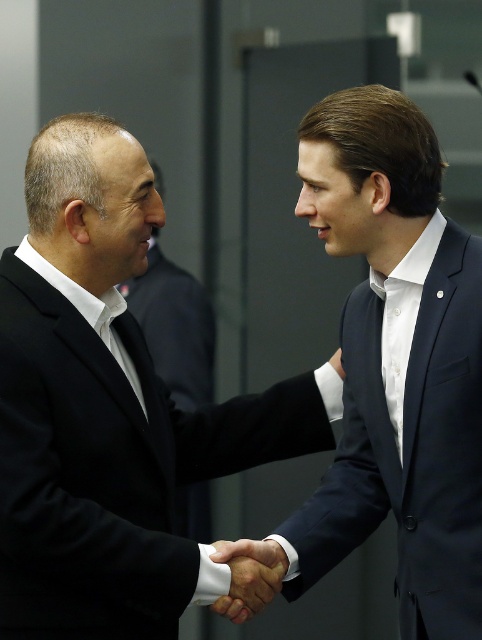
Which of these two, black matte suit at left or matte black suit at left, stands taller?

black matte suit at left

The width and height of the screenshot is (482, 640). What do you see at coordinates (109, 410) in the screenshot?
I see `black matte suit at left` at bounding box center [109, 410].

Identify the location of black matte suit at left. (109, 410).

Is black matte suit at left to the left of navy blue suit at center from the viewer's perspective?

Yes, black matte suit at left is to the left of navy blue suit at center.

Is the position of black matte suit at left less distant than that of navy blue suit at center?

Yes, black matte suit at left is closer to the viewer.

Is point (105, 548) closer to viewer compared to point (441, 486)?

Yes, it is.

Where is `black matte suit at left`? Image resolution: width=482 pixels, height=640 pixels. black matte suit at left is located at coordinates (109, 410).

Consider the image. Who is taller, navy blue suit at center or matte black suit at left?

navy blue suit at center

Between navy blue suit at center and matte black suit at left, which one has less height?

Standing shorter between the two is matte black suit at left.

Find the location of a particular element. navy blue suit at center is located at coordinates (397, 364).

This screenshot has width=482, height=640. Find the location of `navy blue suit at center`. navy blue suit at center is located at coordinates (397, 364).